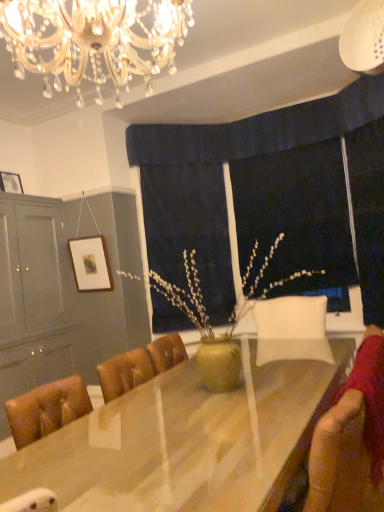
Question: Relative to crystal glass chandelier at upper center, is wooden picture frame at upper left, positioned as the 2th picture frame in left-to-right order, in front or behind?

Choices:
 (A) behind
 (B) front

Answer: (A)

Question: Based on their positions, is wooden picture frame at upper left, acting as the 2th picture frame starting from the top, located to the left or right of crystal glass chandelier at upper center?

Choices:
 (A) right
 (B) left

Answer: (B)

Question: Based on their relative distances, which object is nearer to the black fabric at center?

Choices:
 (A) wooden table at center
 (B) matte yellow vase at center
 (C) dark blue fabric at center
 (D) wooden picture frame at upper left, acting as the 2th picture frame starting from the top
 (E) wooden framed picture at upper left, acting as the second picture frame starting from the right

Answer: (B)

Question: Estimate the real-world distances between objects in this image. Which object is farther from the dark blue fabric at center?

Choices:
 (A) matte gray cabinet at left
 (B) wooden framed picture at upper left, which is the 2th picture frame in bottom-to-top order
 (C) wooden picture frame at upper left, positioned as the 2th picture frame in left-to-right order
 (D) velvet brown swivel chair at lower right
 (E) wooden table at center

Answer: (D)